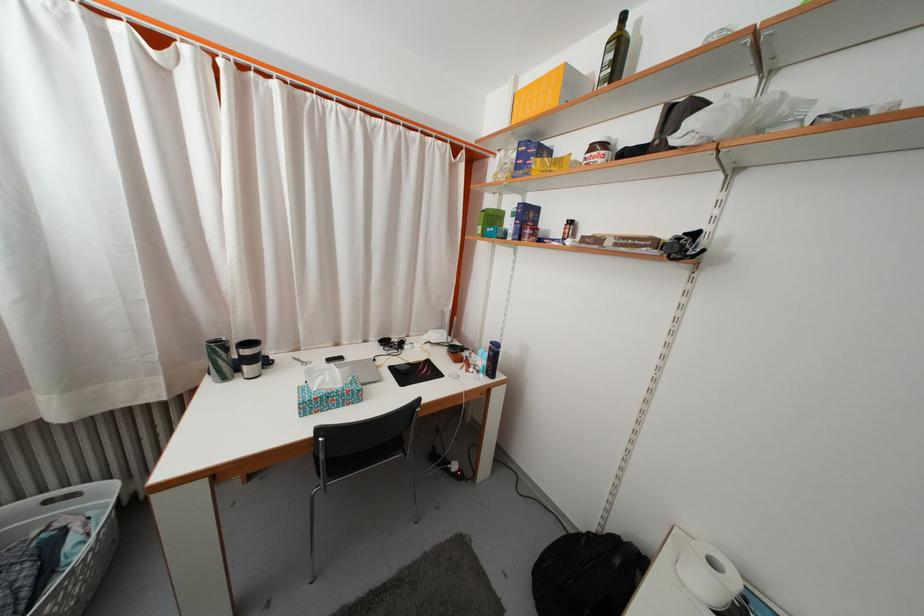
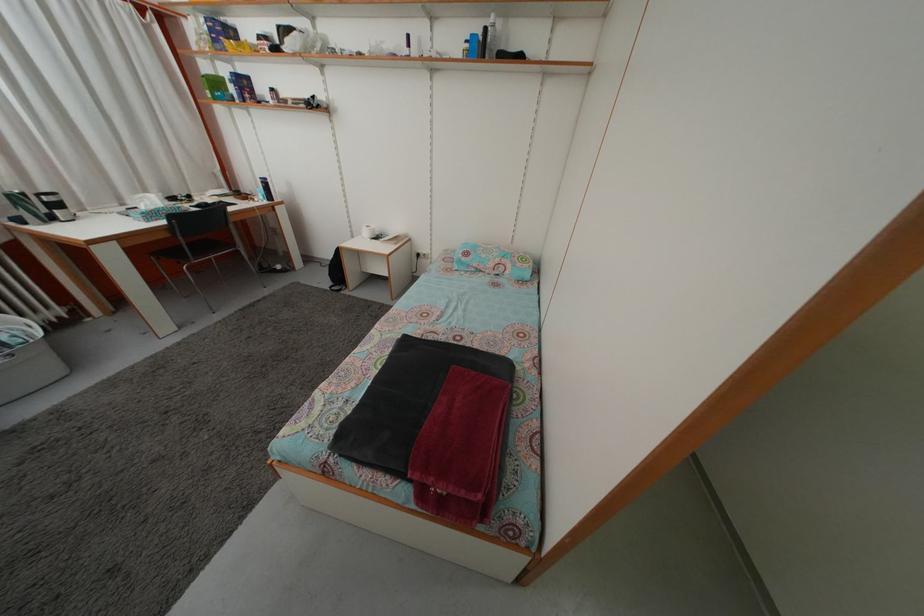
In the second image, find the point that corresponds to the point at 500,225 in the first image.

(223, 91)